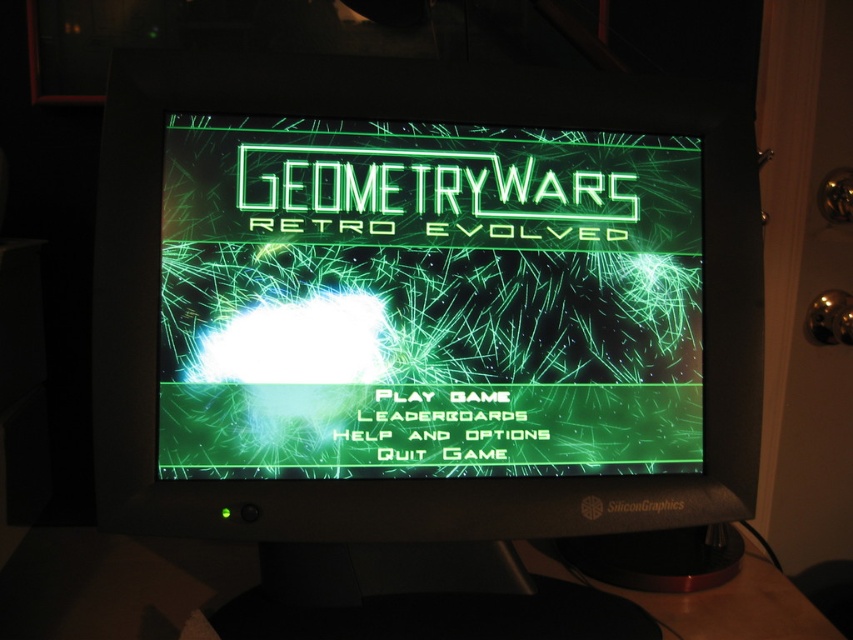
Based on the photo, you are trying to locate the game title on the computer monitor. According to the image, where is the green matte text at center in relation to the black plastic table at lower center?

The green matte text at center is positioned over the black plastic table at lower center.